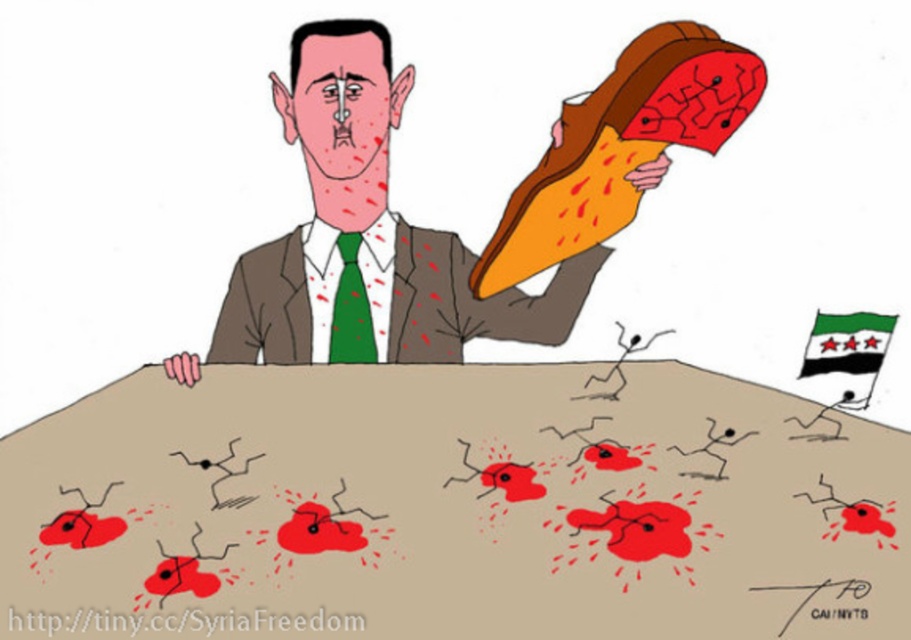
Question: Is beige matte table at center to the left of brown textured suit at center from the viewer's perspective?

Choices:
 (A) yes
 (B) no

Answer: (B)

Question: Which object is the farthest from the beige matte table at center?

Choices:
 (A) brown textured suit at center
 (B) green tie at upper left

Answer: (A)

Question: Which of the following is the closest to the observer?

Choices:
 (A) beige matte table at center
 (B) brown textured suit at center

Answer: (A)

Question: Where is beige matte table at center located in relation to green tie at upper left in the image?

Choices:
 (A) right
 (B) left

Answer: (A)

Question: Considering the real-world distances, which object is farthest from the brown textured suit at center?

Choices:
 (A) beige matte table at center
 (B) green tie at upper left

Answer: (A)

Question: Is green tie at upper left smaller than brown textured suit at center?

Choices:
 (A) yes
 (B) no

Answer: (B)